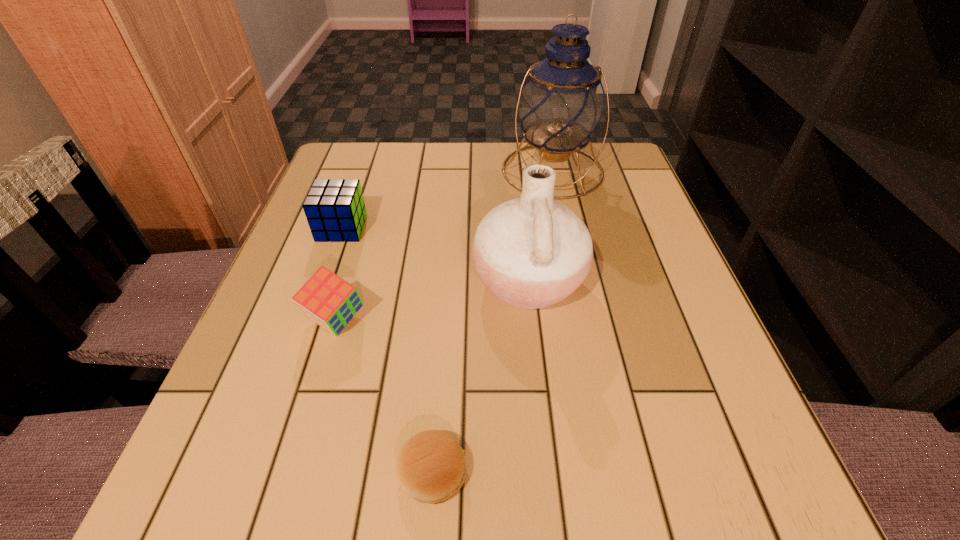
Locate an element on the screen. This screenshot has width=960, height=540. free space located 0.350m to pour from the handle of the second tallest object is located at coordinates (287, 281).

You are a GUI agent. You are given a task and a screenshot of the screen. Output one action in this format:
    pyautogui.click(x=<x>, y=<y>)
    Task: Click on the free space located 0.370m on the right of the nearer cube
    Image resolution: width=960 pixels, height=540 pixels.
    Given the screenshot: What is the action you would take?
    [x=578, y=321]

Find the location of a particular element. Image resolution: width=960 pixels, height=540 pixels. vacant region located 0.050m on the left of the second farthest object is located at coordinates (297, 228).

Where is `free region located on the right of the nearest object`? The image size is (960, 540). free region located on the right of the nearest object is located at coordinates (513, 471).

Locate an element on the screen. This screenshot has height=540, width=960. object located at the far edge is located at coordinates (x=561, y=104).

The width and height of the screenshot is (960, 540). I want to click on object that is at the near edge, so click(431, 467).

In order to click on object that is at the right edge in this screenshot , I will do `click(561, 104)`.

What are the coordinates of `object located in the far right corner section of the desktop` in the screenshot? It's located at (561, 104).

At what (x,y) coordinates should I click in order to perform the action: click on vacant area at the far edge. Please return your answer as a coordinate pair (x, y). Looking at the image, I should click on (407, 178).

Where is `vacant area at the left edge of the desktop`? vacant area at the left edge of the desktop is located at coordinates (277, 315).